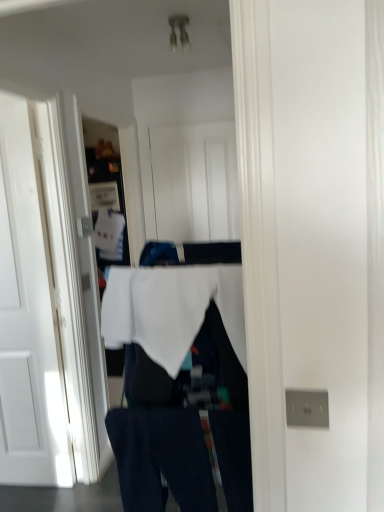
Where is `white wood door at center, the first door in the right-to-left sequence`? This screenshot has height=512, width=384. white wood door at center, the first door in the right-to-left sequence is located at coordinates (x=194, y=182).

Describe the element at coordinates (28, 315) in the screenshot. I see `white matte door at left, which is the 1th door in front-to-back order` at that location.

This screenshot has height=512, width=384. What do you see at coordinates (171, 309) in the screenshot? I see `white fabric at center` at bounding box center [171, 309].

At what (x,y) coordinates should I click in order to perform the action: click on white wood door at center, which ranks as the first door in back-to-front order. Please return your answer as a coordinate pair (x, y). Looking at the image, I should click on (194, 182).

From the image's perspective, between white wood door at center, the first door in the right-to-left sequence, and white matte door at left, the first door positioned from the left, which one is located above?

white wood door at center, the first door in the right-to-left sequence, is shown above in the image.

From their relative heights in the image, would you say white wood door at center, the first door in the right-to-left sequence, is taller or shorter than white matte door at left, marked as the second door in a back-to-front arrangement?

white wood door at center, the first door in the right-to-left sequence, is shorter than white matte door at left, marked as the second door in a back-to-front arrangement.

From a real-world perspective, which object stands above the other?

In real-world perspective, white wood door at center, which appears as the second door when viewed from the front, is above.

From the picture: Is white wood door at center, positioned as the 2th door in left-to-right order, positioned with its back to white matte door at left, marked as the second door in a back-to-front arrangement?

No, white wood door at center, positioned as the 2th door in left-to-right order,'s orientation is not away from white matte door at left, marked as the second door in a back-to-front arrangement.

From a real-world perspective, which is physically below, white wood door at center, positioned as the 2th door in left-to-right order, or white fabric at center?

white fabric at center is physically lower.

Does white wood door at center, the first door in the right-to-left sequence, appear on the left side of white fabric at center?

Incorrect, white wood door at center, the first door in the right-to-left sequence, is not on the left side of white fabric at center.

Is white wood door at center, which ranks as the first door in back-to-front order, surrounding white fabric at center?

Definitely not — white fabric at center is not inside white wood door at center, which ranks as the first door in back-to-front order.

Is white wood door at center, the first door in the right-to-left sequence, taller than white fabric at center?

Yes, white wood door at center, the first door in the right-to-left sequence, is taller than white fabric at center.

Can you confirm if dark blue denim jeans at lower center is wider than white fabric at center?

No.

Considering the relative positions of dark blue denim jeans at lower center and white fabric at center in the image provided, is dark blue denim jeans at lower center to the left or to the right of white fabric at center?

dark blue denim jeans at lower center is positioned on white fabric at center's left side.

Is dark blue denim jeans at lower center oriented away from white fabric at center?

No, white fabric at center is not at the back of dark blue denim jeans at lower center.

Is there a large distance between dark blue denim jeans at lower center and white fabric at center?

That's not correct — dark blue denim jeans at lower center is a little close to white fabric at center.

Can you tell me how much white matte door at left, the first door positioned from the left, and white fabric at center differ in facing direction?

There is a 96.6-degree angle between the facing directions of white matte door at left, the first door positioned from the left, and white fabric at center.

Does white matte door at left, which is the 1th door in front-to-back order, have a greater width compared to white fabric at center?

No.

Which of these two, white matte door at left, marked as the second door in a back-to-front arrangement, or white fabric at center, is smaller?

Smaller between the two is white matte door at left, marked as the second door in a back-to-front arrangement.

From the image's perspective, is white matte door at left, which is the 1th door in front-to-back order, above or below white wood door at center, which ranks as the first door in back-to-front order?

Based on their image positions, white matte door at left, which is the 1th door in front-to-back order, is located beneath white wood door at center, which ranks as the first door in back-to-front order.

What's the angular difference between white matte door at left, the first door positioned from the left, and white wood door at center, which ranks as the first door in back-to-front order,'s facing directions?

white matte door at left, the first door positioned from the left, and white wood door at center, which ranks as the first door in back-to-front order, are facing 5.79 degrees away from each other.

Considering the positions of point (35, 245) and point (232, 172), is point (35, 245) closer or farther from the camera than point (232, 172)?

Point (35, 245) is positioned closer to the camera compared to point (232, 172).

Is white wood door at center, which ranks as the first door in back-to-front order, not within dark blue denim jeans at lower center?

Indeed, white wood door at center, which ranks as the first door in back-to-front order, is completely outside dark blue denim jeans at lower center.

Measure the distance between white wood door at center, which appears as the second door when viewed from the front, and dark blue denim jeans at lower center.

The distance of white wood door at center, which appears as the second door when viewed from the front, from dark blue denim jeans at lower center is 1.97 meters.

Does white wood door at center, positioned as the 2th door in left-to-right order, appear on the right side of dark blue denim jeans at lower center?

Indeed, white wood door at center, positioned as the 2th door in left-to-right order, is positioned on the right side of dark blue denim jeans at lower center.

Which of these two, white fabric at center or dark blue denim jeans at lower center, is smaller?

dark blue denim jeans at lower center.

At what (x,y) coordinates should I click in order to perform the action: click on sheet above the dark blue denim jeans at lower center (from a real-world perspective). Please return your answer as a coordinate pair (x, y). The image size is (384, 512). Looking at the image, I should click on (171, 309).

From the image's perspective, which one is positioned higher, white fabric at center or dark blue denim jeans at lower center?

white fabric at center appears higher in the image.

Is white fabric at center not within dark blue denim jeans at lower center?

That's correct, white fabric at center is outside of dark blue denim jeans at lower center.

In order to click on door above the white matte door at left, which is the 1th door in front-to-back order (from a real-world perspective) in this screenshot , I will do `click(194, 182)`.

Where is `sheet in front of the white wood door at center, the first door in the right-to-left sequence`? sheet in front of the white wood door at center, the first door in the right-to-left sequence is located at coordinates (171, 309).

Considering their positions, is white fabric at center positioned further to white wood door at center, which appears as the second door when viewed from the front, than white fabric at center?

Based on the image, white fabric at center appears to be further to white wood door at center, which appears as the second door when viewed from the front.

Looking at the image, which one is located further to white matte door at left, which is counted as the 2th door, starting from the right, white fabric at center or white wood door at center, which appears as the second door when viewed from the front?

The object further to white matte door at left, which is counted as the 2th door, starting from the right, is white wood door at center, which appears as the second door when viewed from the front.

Considering their positions, is white fabric at center positioned further to white matte door at left, marked as the second door in a back-to-front arrangement, than dark blue denim jeans at lower center?

Based on the image, white fabric at center appears to be further to white matte door at left, marked as the second door in a back-to-front arrangement.

Based on their spatial positions, is white matte door at left, marked as the second door in a back-to-front arrangement, or white wood door at center, which appears as the second door when viewed from the front, closer to white fabric at center?

white matte door at left, marked as the second door in a back-to-front arrangement.

Considering their positions, is white wood door at center, which ranks as the first door in back-to-front order, positioned further to white fabric at center than white fabric at center?

white wood door at center, which ranks as the first door in back-to-front order, is positioned further to the anchor white fabric at center.

When comparing their distances from white wood door at center, positioned as the 2th door in left-to-right order, does white matte door at left, the first door positioned from the left, or dark blue denim jeans at lower center seem closer?

Among the two, white matte door at left, the first door positioned from the left, is located nearer to white wood door at center, positioned as the 2th door in left-to-right order.

Based on their spatial positions, is white fabric at center or white wood door at center, positioned as the 2th door in left-to-right order, closer to white matte door at left, which is counted as the 2th door, starting from the right?

The object closer to white matte door at left, which is counted as the 2th door, starting from the right, is white fabric at center.

From the picture: From the image, which object appears to be farther from white wood door at center, which appears as the second door when viewed from the front, white fabric at center or dark blue denim jeans at lower center?

Among the two, dark blue denim jeans at lower center is located further to white wood door at center, which appears as the second door when viewed from the front.

The width and height of the screenshot is (384, 512). Find the location of `door positioned between white fabric at center and white wood door at center, which appears as the second door when viewed from the front, from near to far`. door positioned between white fabric at center and white wood door at center, which appears as the second door when viewed from the front, from near to far is located at coordinates (28, 315).

Where is `person between white fabric at center and white wood door at center, which ranks as the first door in back-to-front order, along the z-axis`? Image resolution: width=384 pixels, height=512 pixels. person between white fabric at center and white wood door at center, which ranks as the first door in back-to-front order, along the z-axis is located at coordinates (171, 376).

Image resolution: width=384 pixels, height=512 pixels. I want to click on jeans positioned between white fabric at center and white wood door at center, which ranks as the first door in back-to-front order, from near to far, so click(161, 459).

You are a GUI agent. You are given a task and a screenshot of the screen. Output one action in this format:
    pyautogui.click(x=<x>, y=<y>)
    Task: Click on the jeans between white matte door at left, which is counted as the 2th door, starting from the right, and white fabric at center from left to right
    The height and width of the screenshot is (512, 384).
    Given the screenshot: What is the action you would take?
    pyautogui.click(x=161, y=459)